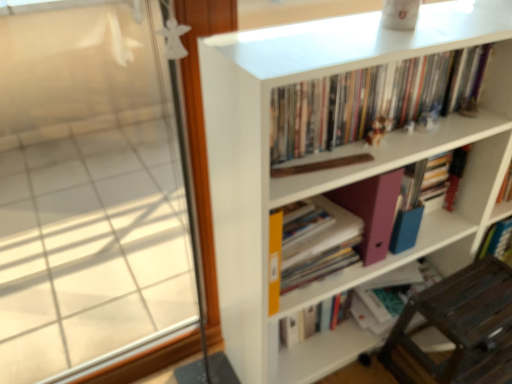
Question: From a real-world perspective, is matte pink folder at center above or below matte pink folder at lower center, arranged as the first book when ordered from the bottom?

Choices:
 (A) below
 (B) above

Answer: (B)

Question: In the image, is matte pink folder at center on the left side or the right side of matte pink folder at lower center, arranged as the first book when ordered from the bottom?

Choices:
 (A) right
 (B) left

Answer: (B)

Question: Estimate the real-world distances between objects in this image. Which object is closer to the brown wooden chair at lower right?

Choices:
 (A) white matte bookcase at upper right
 (B) transparent glass window at left
 (C) matte pink folder at center
 (D) hardcover books at upper center, the 4th book ordered from the bottom
 (E) hardcover book at center, the 3th book when ordered from bottom to top

Answer: (C)

Question: Which is farther from the white matte bookcase at upper right?

Choices:
 (A) hardcover book at center, the 3th book when ordered from bottom to top
 (B) matte pink folder at center
 (C) hardcover books at upper center, the 4th book ordered from the bottom
 (D) matte pink folder at lower center, which is counted as the 4th book, starting from the top
 (E) transparent glass window at left

Answer: (E)